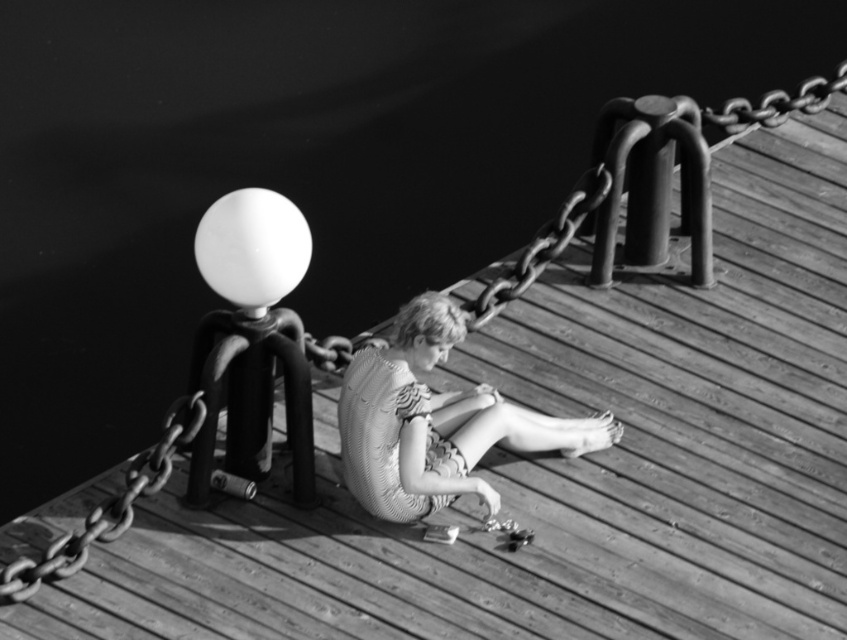
Question: Does knitted fabric dress at center appear over metallic chain at left?

Choices:
 (A) no
 (B) yes

Answer: (B)

Question: In this image, where is knitted fabric dress at center located relative to metallic chain at upper right?

Choices:
 (A) below
 (B) above

Answer: (A)

Question: Which point appears closest to the camera in this image?

Choices:
 (A) (469, 324)
 (B) (347, 444)

Answer: (B)

Question: Which is nearer to the metallic chain at left?

Choices:
 (A) metallic chain at upper right
 (B) knitted fabric dress at center

Answer: (B)

Question: Is metallic chain at left bigger than metallic chain at upper right?

Choices:
 (A) no
 (B) yes

Answer: (A)

Question: Which of the following is the farthest from the observer?

Choices:
 (A) knitted fabric dress at center
 (B) white matte balloon at upper center

Answer: (A)